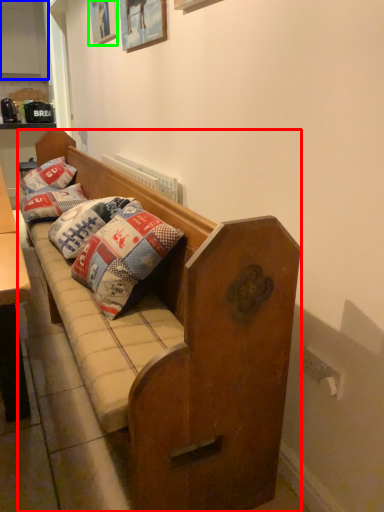
Question: Estimate the real-world distances between objects in this image. Which object is closer to studio couch (highlighted by a red box), cabinetry (highlighted by a blue box) or picture frame (highlighted by a green box)?

Choices:
 (A) cabinetry
 (B) picture frame

Answer: (B)